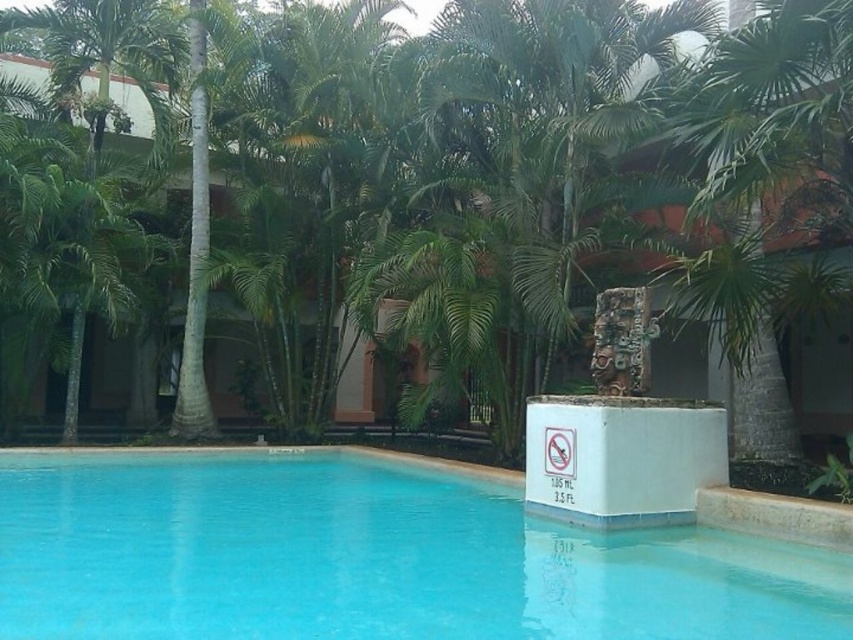
Question: Can you confirm if blue glossy water at center is thinner than green leafy palm tree at center?

Choices:
 (A) yes
 (B) no

Answer: (B)

Question: Which object is closer to the camera taking this photo?

Choices:
 (A) blue glossy water at center
 (B) green leafy palm tree at center

Answer: (A)

Question: Does blue glossy water at center appear on the left side of green leafy palm tree at center?

Choices:
 (A) yes
 (B) no

Answer: (A)

Question: Which object appears closest to the camera in this image?

Choices:
 (A) green leafy palm tree at center
 (B) blue glossy water at center

Answer: (B)

Question: In this image, where is blue glossy water at center located relative to green leafy palm tree at center?

Choices:
 (A) left
 (B) right

Answer: (A)

Question: Among these objects, which one is nearest to the camera?

Choices:
 (A) green leafy palm tree at center
 (B) blue glossy water at center

Answer: (B)